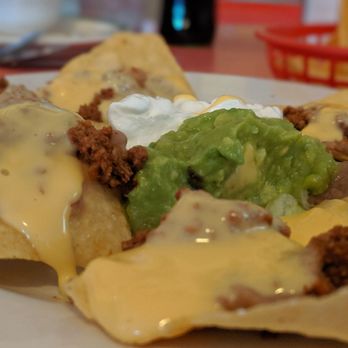
What are the coordinates of `rim of plate above nachos` in the screenshot? It's located at (245, 86).